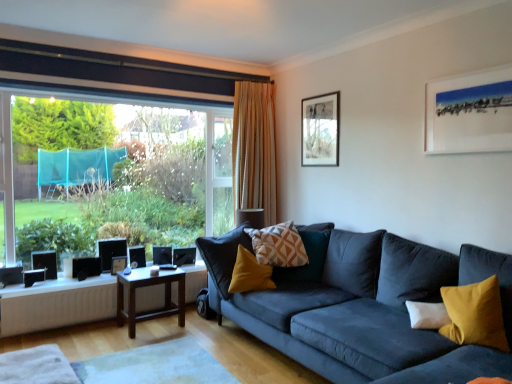
You are a GUI agent. You are given a task and a screenshot of the screen. Output one action in this format:
    pyautogui.click(x=<x>, y=<y>)
    Task: Click on the vacant space that is to the left of brown wooden table at center, the 2th table when ordered from top to bottom
    
    Given the screenshot: What is the action you would take?
    pyautogui.click(x=97, y=334)